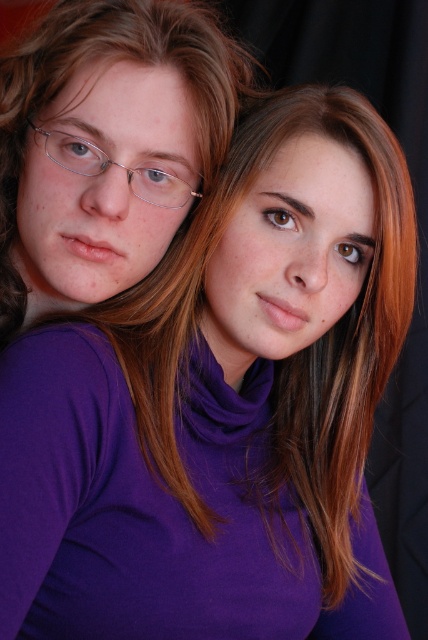
Can you confirm if matte purple turtleneck at center is smaller than clear plastic glasses at upper left?

No, matte purple turtleneck at center is not smaller than clear plastic glasses at upper left.

In the scene shown: Between matte purple turtleneck at center and clear plastic glasses at upper left, which one has less height?

clear plastic glasses at upper left is shorter.

Who is more distant from viewer, (36, 99) or (68, 160)?

Positioned behind is point (36, 99).

Image resolution: width=428 pixels, height=640 pixels. Identify the location of matte purple turtleneck at center. pos(113,61).